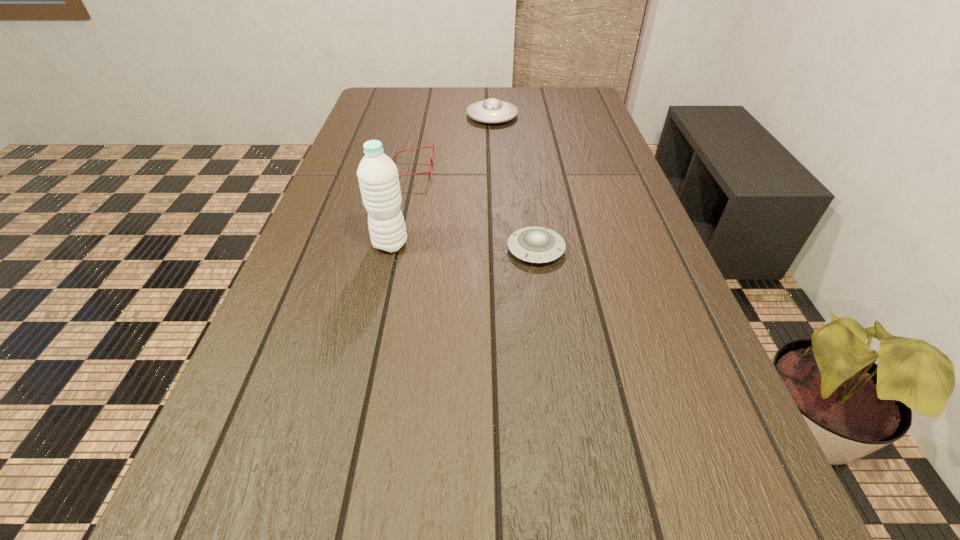
I want to click on the tallest object, so click(x=378, y=178).

Locate an element on the screen. The image size is (960, 540). the farthest object is located at coordinates (492, 110).

Image resolution: width=960 pixels, height=540 pixels. Identify the location of the taller saucer. (492, 110).

The image size is (960, 540). Identify the location of spectacles. (432, 162).

Locate an element on the screen. This screenshot has height=540, width=960. the shorter saucer is located at coordinates (533, 244).

Locate an element on the screen. The height and width of the screenshot is (540, 960). the nearer saucer is located at coordinates (533, 244).

The width and height of the screenshot is (960, 540). I want to click on free space located on the back of the water bottle, so click(x=403, y=187).

I want to click on free space located 0.070m on the front of the farther saucer, so click(493, 138).

This screenshot has height=540, width=960. What are the coordinates of `vacant space located on the face of the second farthest object` in the screenshot? It's located at (470, 172).

Where is `vacant area situated on the front of the shorter saucer`? Image resolution: width=960 pixels, height=540 pixels. vacant area situated on the front of the shorter saucer is located at coordinates (555, 388).